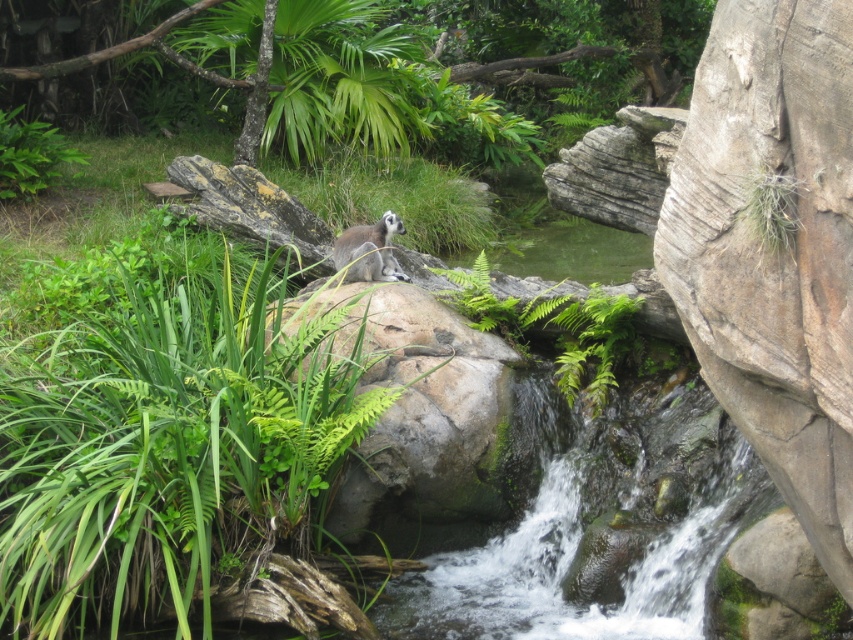
Question: Which point is closer to the camera?

Choices:
 (A) ring-tailed lemur at center
 (B) green leafy fern at upper center

Answer: (B)

Question: Considering the relative positions of green leafy fern at upper center and ring-tailed lemur at center in the image provided, where is green leafy fern at upper center located with respect to ring-tailed lemur at center?

Choices:
 (A) left
 (B) right

Answer: (A)

Question: Is green leafy fern at upper center thinner than ring-tailed lemur at center?

Choices:
 (A) no
 (B) yes

Answer: (A)

Question: Among these objects, which one is farthest from the camera?

Choices:
 (A) green leafy fern at upper center
 (B) ring-tailed lemur at center

Answer: (B)

Question: Is green leafy fern at upper center behind ring-tailed lemur at center?

Choices:
 (A) no
 (B) yes

Answer: (A)